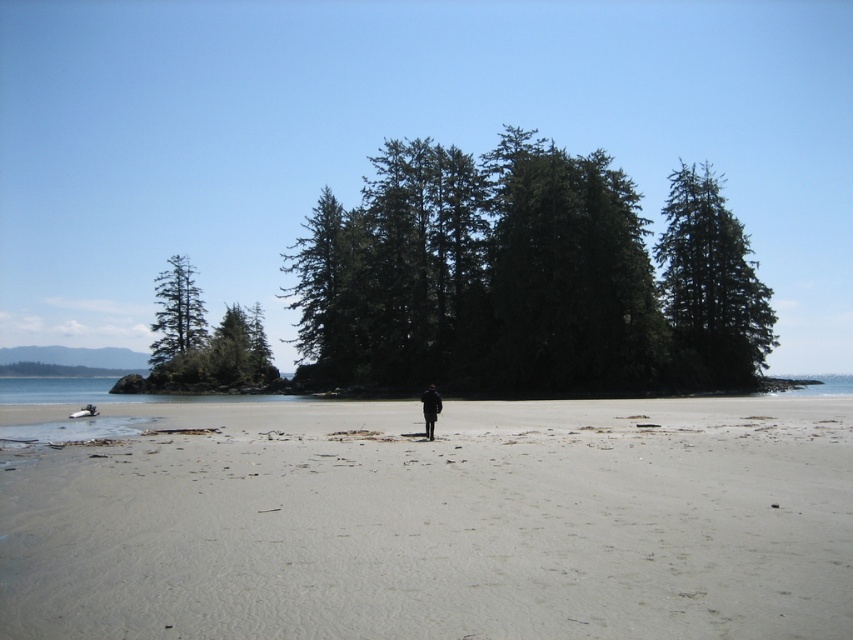
Does light beige sand at center have a larger size compared to black matte jacket at center?

Yes, light beige sand at center is bigger than black matte jacket at center.

Is point (569, 483) farther from camera compared to point (422, 404)?

No, it is not.

Where is `light beige sand at center`? The height and width of the screenshot is (640, 853). light beige sand at center is located at coordinates (440, 524).

Based on the photo, does light beige sand at center have a greater width compared to green textured tree at upper right?

No.

Between light beige sand at center and green textured tree at upper right, which one appears on the right side from the viewer's perspective?

From the viewer's perspective, green textured tree at upper right appears more on the right side.

Does point (686, 534) lie behind point (699, 273)?

No, (686, 534) is closer to viewer.

What are the coordinates of `light beige sand at center` in the screenshot? It's located at (440, 524).

Looking at this image, who is positioned more to the left, green matte trees at center or black matte jacket at center?

black matte jacket at center

Measure the distance between green matte trees at center and black matte jacket at center.

green matte trees at center and black matte jacket at center are 32.06 meters apart.

This screenshot has height=640, width=853. What do you see at coordinates (525, 276) in the screenshot?
I see `green matte trees at center` at bounding box center [525, 276].

You are a GUI agent. You are given a task and a screenshot of the screen. Output one action in this format:
    pyautogui.click(x=<x>, y=<y>)
    Task: Click on the green matte trees at center
    Image resolution: width=853 pixels, height=640 pixels.
    Given the screenshot: What is the action you would take?
    pyautogui.click(x=525, y=276)